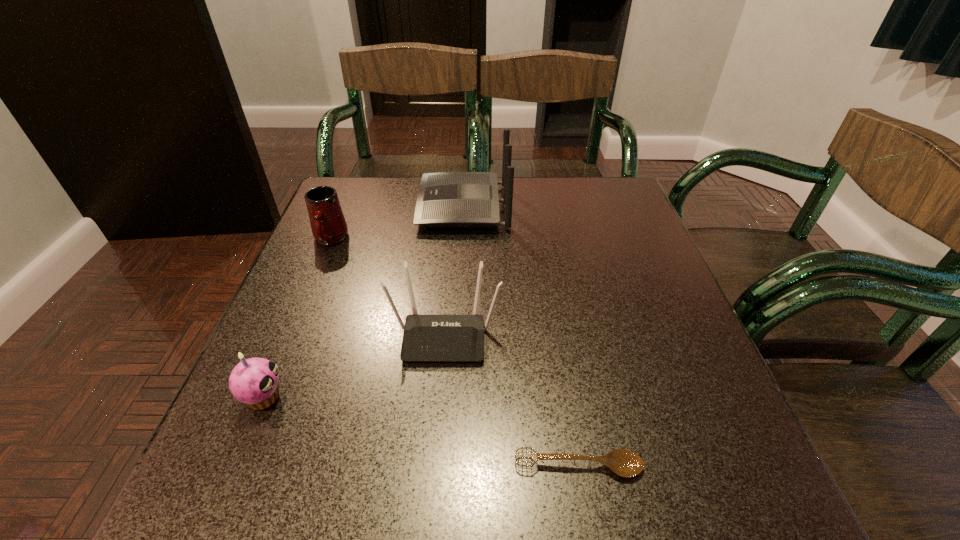
Where is `free space that is in between the shorter router and the second nearest object`? This screenshot has height=540, width=960. free space that is in between the shorter router and the second nearest object is located at coordinates pos(354,366).

Identify the location of empty space between the tallest object and the cupcake. The width and height of the screenshot is (960, 540). (364, 301).

Find the location of a particular element. This screenshot has height=540, width=960. unoccupied area between the farther router and the mug is located at coordinates (397, 223).

What are the coordinates of `free space between the shortest object and the farther router` in the screenshot? It's located at (521, 336).

Where is `free space between the tallest object and the cupcake`? This screenshot has width=960, height=540. free space between the tallest object and the cupcake is located at coordinates click(x=364, y=301).

Identify the location of the closest object relative to the shorter router. (254, 381).

Choose which object is the third nearest neighbor to the mug. Please provide its 2D coordinates. Your answer should be formatted as a tuple, i.e. [(x, y)], where the tuple contains the x and y coordinates of a point satisfying the conditions above.

[(254, 381)]

Locate an element on the screen. Image resolution: width=960 pixels, height=540 pixels. free space that satisfies the following two spatial constraints: 1. on the front-facing side of the shorter router; 2. on the face of the second nearest object is located at coordinates (440, 397).

The height and width of the screenshot is (540, 960). In order to click on vacant space that satisfies the following two spatial constraints: 1. on the face of the second nearest object; 2. on the back side of the ladle in this screenshot , I will do `click(234, 466)`.

Where is `free space that satisfies the following two spatial constraints: 1. on the face of the second nearest object; 2. on the back side of the nearest object`? free space that satisfies the following two spatial constraints: 1. on the face of the second nearest object; 2. on the back side of the nearest object is located at coordinates (234, 466).